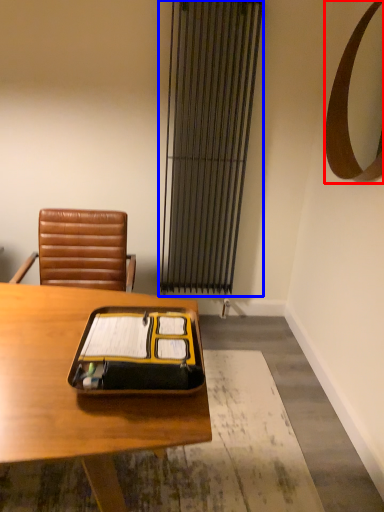
Question: Which of the following is the closest to the observer, mirror (highlighted by a red box) or curtain (highlighted by a blue box)?

Choices:
 (A) mirror
 (B) curtain

Answer: (A)